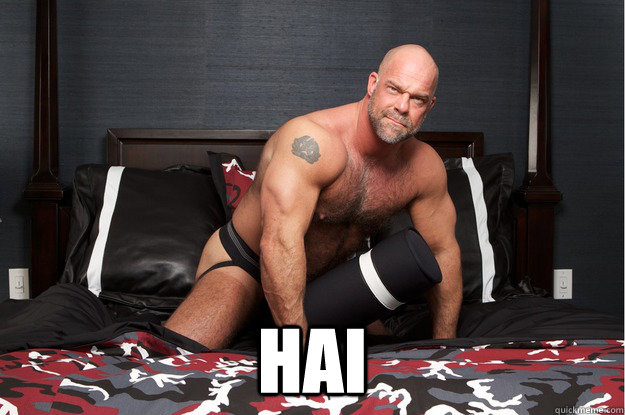
In order to click on blanket in this screenshot , I will do `click(194, 392)`.